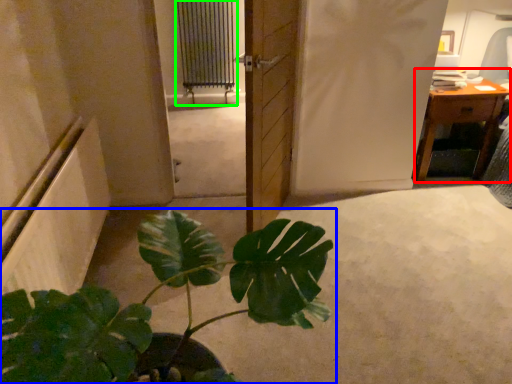
Question: Which object is positioned closest to table (highlighted by a red box)? Select from houseplant (highlighted by a blue box) and radiator (highlighted by a green box).

Choices:
 (A) houseplant
 (B) radiator

Answer: (A)